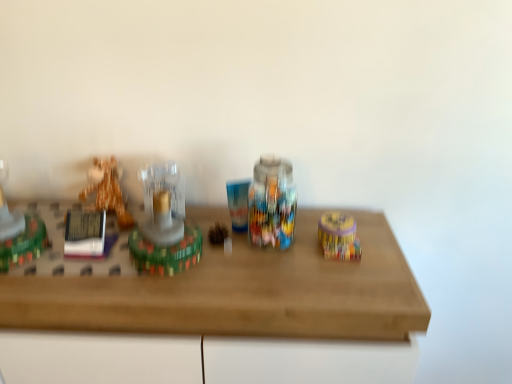
Question: From the image's perspective, relative to shiny green plastic toy at left, acting as the 1th toy starting from the left, is matte yellow container at right, which is counted as the first toy, starting from the right, above or below?

Choices:
 (A) above
 (B) below

Answer: (B)

Question: Relative to shiny green plastic toy at left, acting as the 1th toy starting from the left, is matte yellow container at right, which is counted as the first toy, starting from the right, in front or behind?

Choices:
 (A) behind
 (B) front

Answer: (A)

Question: Which object is the farthest from the matte yellow container at right, which ranks as the 4th toy in left-to-right order?

Choices:
 (A) wooden table at center
 (B) translucent glass candle at center, positioned as the second toy in right-to-left order
 (C) plush orange bear at left, the 3th toy viewed from the right
 (D) shiny green plastic toy at left, acting as the 1th toy starting from the left

Answer: (D)

Question: Estimate the real-world distances between objects in this image. Which object is closer to the wooden table at center?

Choices:
 (A) plush orange bear at left, which is counted as the second toy, starting from the left
 (B) translucent glass candle at center, placed as the third toy when sorted from left to right
 (C) matte yellow container at right, which ranks as the 4th toy in left-to-right order
 (D) shiny green plastic toy at left, acting as the 1th toy starting from the left

Answer: (B)